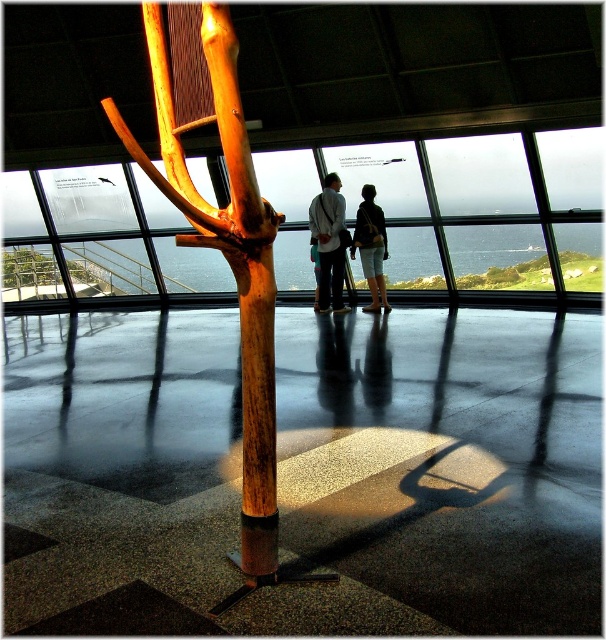
You are standing in the room and want to place a small plant pot on the natural wood pole at center. However, there is a white cotton shirt at center in the way. Can you place the pot on the pole without moving the shirt?

The natural wood pole at center is located below the white cotton shirt at center, so you can place the plant pot on the pole since the shirt is above it and not blocking access.

You are an interior designer planning to hang a large painting that requires a 2.5 meters height space. Based on the scene, can you determine if the transparent glass window at center or the wooden sculpture at center has enough vertical space to accommodate the painting?

The wooden sculpture at center has a greater height than the transparent glass window at center. Since the painting requires 2.5 meters, you should check the height of the wooden sculpture at center to see if it meets the requirement.

Consider the image. You are an interior designer planning to place a 1.5 meter wide sofa between the transparent glass window at center and the wooden sculpture at center. Can the sofa fit in the space between them?

The transparent glass window at center is wider than the wooden sculpture at center. However, the exact distance between them isn not specified in the objects description. Therefore, it is unclear if the 1.5 meter wide sofa will fit between them.